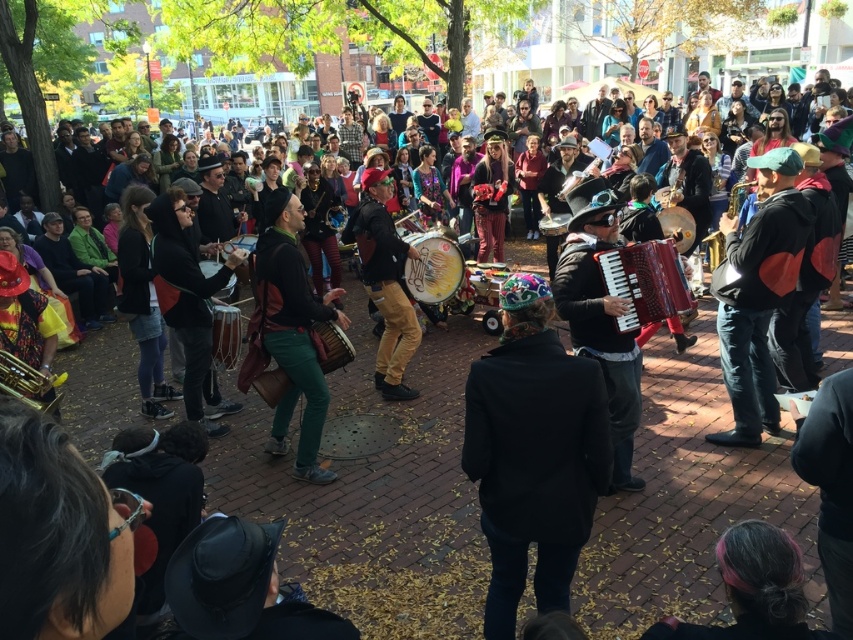
You are a spectator standing in front of the musicians. You see the matte drum at center and the wooden drum at center. Which one is positioned higher from the ground?

The matte drum at center is located above the wooden drum at center, so it is positioned higher from the ground.

You are a street performer who needs to pass between the two musicians playing the matte drum at center and the large drum in the background. The path between them is 6.52 meters wide. If your performance prop is 6 meters wide, can you safely move through this space without touching either drum?

The path between the two drums is 6.52 meters wide, which is wider than your 6 meters wide prop. Therefore, you can safely move through the space without touching either drum.